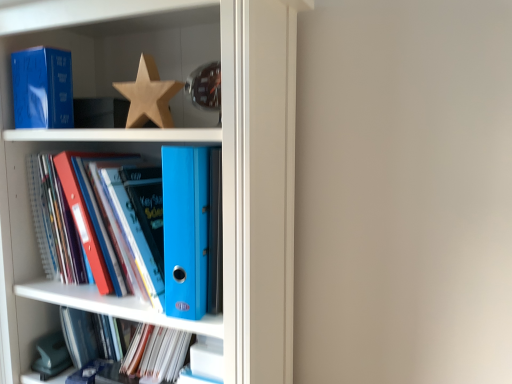
Question: From the image's perspective, is matte blue paperback book at upper left located above matte blue folder at lower center, the first book ordered from the bottom?

Choices:
 (A) no
 (B) yes

Answer: (B)

Question: Would you say matte blue folder at lower center, the first book ordered from the bottom, is part of matte blue paperback book at upper left's contents?

Choices:
 (A) yes
 (B) no

Answer: (B)

Question: Considering the relative sizes of matte blue paperback book at upper left and matte blue folder at lower center, the first book ordered from the bottom, in the image provided, is matte blue paperback book at upper left bigger than matte blue folder at lower center, the first book ordered from the bottom,?

Choices:
 (A) no
 (B) yes

Answer: (A)

Question: From a real-world perspective, is matte blue paperback book at upper left physically above matte blue folder at lower center, the first book ordered from the bottom?

Choices:
 (A) yes
 (B) no

Answer: (A)

Question: Does matte blue paperback book at upper left have a greater height compared to matte blue folder at lower center, the first book ordered from the bottom?

Choices:
 (A) no
 (B) yes

Answer: (B)

Question: Is point (144, 87) closer or farther from the camera than point (161, 286)?

Choices:
 (A) farther
 (B) closer

Answer: (A)

Question: Considering the relative positions of wooden star at upper center and blue plastic ring binder at center, the second book in the bottom-to-top sequence, in the image provided, is wooden star at upper center to the left or to the right of blue plastic ring binder at center, the second book in the bottom-to-top sequence,?

Choices:
 (A) right
 (B) left

Answer: (A)

Question: In terms of height, does wooden star at upper center look taller or shorter compared to blue plastic ring binder at center, the second book in the bottom-to-top sequence?

Choices:
 (A) tall
 (B) short

Answer: (B)

Question: In the image, is wooden star at upper center positioned in front of or behind blue plastic ring binder at center, the second book in the bottom-to-top sequence?

Choices:
 (A) behind
 (B) front

Answer: (A)

Question: Is blue plastic ring binder at center, placed as the first book when sorted from top to bottom, taller or shorter than matte blue binder at center?

Choices:
 (A) tall
 (B) short

Answer: (B)

Question: Considering the relative positions of blue plastic ring binder at center, placed as the first book when sorted from top to bottom, and matte blue binder at center in the image provided, is blue plastic ring binder at center, placed as the first book when sorted from top to bottom, to the left or to the right of matte blue binder at center?

Choices:
 (A) left
 (B) right

Answer: (A)

Question: Considering the positions of blue plastic ring binder at center, placed as the first book when sorted from top to bottom, and matte blue binder at center in the image, is blue plastic ring binder at center, placed as the first book when sorted from top to bottom, bigger or smaller than matte blue binder at center?

Choices:
 (A) big
 (B) small

Answer: (B)

Question: Which is correct: blue plastic ring binder at center, placed as the first book when sorted from top to bottom, is inside matte blue binder at center, or outside of it?

Choices:
 (A) inside
 (B) outside

Answer: (A)

Question: Considering the positions of wooden star at upper center and matte blue folder at lower center, placed as the second book when sorted from top to bottom, in the image, is wooden star at upper center taller or shorter than matte blue folder at lower center, placed as the second book when sorted from top to bottom,?

Choices:
 (A) short
 (B) tall

Answer: (B)

Question: From the image's perspective, relative to matte blue folder at lower center, the first book ordered from the bottom, is wooden star at upper center above or below?

Choices:
 (A) above
 (B) below

Answer: (A)